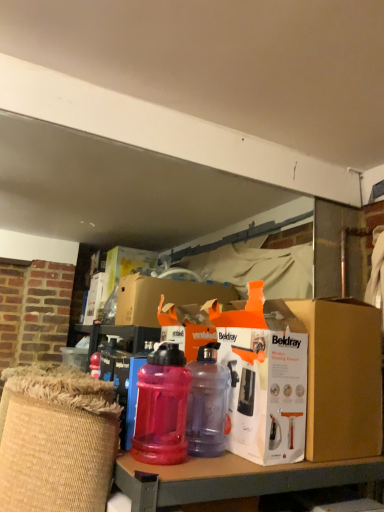
This screenshot has height=512, width=384. What do you see at coordinates (342, 378) in the screenshot?
I see `orange cardboard box at center` at bounding box center [342, 378].

Describe the element at coordinates (207, 404) in the screenshot. The height and width of the screenshot is (512, 384). I see `translucent plastic water bottle at center, which is the second bottle from left to right` at that location.

Identify the location of white cardboard box at center. The height and width of the screenshot is (512, 384). (254, 371).

Find the location of a particular element. The width and height of the screenshot is (384, 512). translucent plastic water bottle at center, the second bottle in the right-to-left sequence is located at coordinates (162, 407).

Between orange cardboard box at center and translucent plastic water bottle at center, the second bottle in the right-to-left sequence, which one has larger size?

Bigger between the two is orange cardboard box at center.

What's the angular difference between orange cardboard box at center and translucent plastic water bottle at center, which is the first bottle from left to right,'s facing directions?

The facing directions of orange cardboard box at center and translucent plastic water bottle at center, which is the first bottle from left to right, are 0.601 degrees apart.

Which is more to the right, orange cardboard box at center or translucent plastic water bottle at center, the second bottle in the right-to-left sequence?

Positioned to the right is orange cardboard box at center.

Considering the positions of points (341, 310) and (150, 373), is point (341, 310) closer to camera compared to point (150, 373)?

No, (341, 310) is further to viewer.

Choose the correct answer: Is translucent plastic water bottle at center, which is the first bottle from left to right, inside orange cardboard box at center or outside it?

translucent plastic water bottle at center, which is the first bottle from left to right, is outside orange cardboard box at center.

Who is bigger, translucent plastic water bottle at center, which is the first bottle from left to right, or orange cardboard box at center?

Bigger between the two is orange cardboard box at center.

Would you consider translucent plastic water bottle at center, which is the first bottle from left to right, to be distant from orange cardboard box at center?

No, translucent plastic water bottle at center, which is the first bottle from left to right, is in close proximity to orange cardboard box at center.

From the image's perspective, is translucent plastic water bottle at center, the second bottle in the right-to-left sequence, beneath orange cardboard box at center?

Yes, from the image's perspective, translucent plastic water bottle at center, the second bottle in the right-to-left sequence, is below orange cardboard box at center.

Between orange cardboard box at center and white cardboard box at center, which one has less height?

With less height is orange cardboard box at center.

Looking at this image, who is bigger, orange cardboard box at center or white cardboard box at center?

With larger size is orange cardboard box at center.

Is orange cardboard box at center with white cardboard box at center?

No, orange cardboard box at center is not with white cardboard box at center.

Is white cardboard box at center not close to translucent plastic water bottle at center, placed as the first bottle when sorted from right to left?

No, there isn't a large distance between white cardboard box at center and translucent plastic water bottle at center, placed as the first bottle when sorted from right to left.

In the scene shown: Would you say white cardboard box at center is to the left or to the right of translucent plastic water bottle at center, which is the second bottle from left to right, in the picture?

white cardboard box at center is to the right of translucent plastic water bottle at center, which is the second bottle from left to right.

From the image's perspective, would you say white cardboard box at center is shown under translucent plastic water bottle at center, placed as the first bottle when sorted from right to left?

Actually, white cardboard box at center appears above translucent plastic water bottle at center, placed as the first bottle when sorted from right to left, in the image.

Consider the image. Is white cardboard box at center in front of or behind translucent plastic water bottle at center, placed as the first bottle when sorted from right to left, in the image?

Visually, white cardboard box at center is located in front of translucent plastic water bottle at center, placed as the first bottle when sorted from right to left.

Is orange cardboard box at center next to translucent plastic water bottle at center, which is the second bottle from left to right?

orange cardboard box at center and translucent plastic water bottle at center, which is the second bottle from left to right, are not in contact.

Which object is positioned more to the left, orange cardboard box at center or translucent plastic water bottle at center, which is the second bottle from left to right?

translucent plastic water bottle at center, which is the second bottle from left to right, is more to the left.

Which of these two, orange cardboard box at center or translucent plastic water bottle at center, placed as the first bottle when sorted from right to left, is thinner?

With smaller width is translucent plastic water bottle at center, placed as the first bottle when sorted from right to left.

From a real-world perspective, does translucent plastic water bottle at center, placed as the first bottle when sorted from right to left, stand above white cardboard box at center?

No.

Can you tell me how much translucent plastic water bottle at center, placed as the first bottle when sorted from right to left, and white cardboard box at center differ in facing direction?

They differ by 0.264 degrees in their facing directions.

Does translucent plastic water bottle at center, which is the second bottle from left to right, turn towards white cardboard box at center?

Yes, translucent plastic water bottle at center, which is the second bottle from left to right, is aimed at white cardboard box at center.

Which object is further away from the camera taking this photo, translucent plastic water bottle at center, which is the second bottle from left to right, or white cardboard box at center?

Positioned behind is translucent plastic water bottle at center, which is the second bottle from left to right.

Does translucent plastic water bottle at center, the second bottle in the right-to-left sequence, have a smaller size compared to white cardboard box at center?

Indeed, translucent plastic water bottle at center, the second bottle in the right-to-left sequence, has a smaller size compared to white cardboard box at center.

Is translucent plastic water bottle at center, the second bottle in the right-to-left sequence, placed right next to white cardboard box at center?

They are not placed beside each other.

Where is `the 2nd bottle counting from the left of the orange cardboard box at center`? the 2nd bottle counting from the left of the orange cardboard box at center is located at coordinates (162, 407).

Locate an element on the screen. Image resolution: width=384 pixels, height=512 pixels. cardboard box above the translucent plastic water bottle at center, the second bottle in the right-to-left sequence (from a real-world perspective) is located at coordinates (342, 378).

Estimate the real-world distances between objects in this image. Which object is further from translucent plastic water bottle at center, placed as the first bottle when sorted from right to left, white cardboard box at center or orange cardboard box at center?

The object further to translucent plastic water bottle at center, placed as the first bottle when sorted from right to left, is orange cardboard box at center.

Based on their spatial positions, is translucent plastic water bottle at center, which is the first bottle from left to right, or white cardboard box at center further from orange cardboard box at center?

translucent plastic water bottle at center, which is the first bottle from left to right, is positioned further to the anchor orange cardboard box at center.

From the image, which object appears to be nearer to translucent plastic water bottle at center, which is the first bottle from left to right, translucent plastic water bottle at center, placed as the first bottle when sorted from right to left, or white cardboard box at center?

translucent plastic water bottle at center, placed as the first bottle when sorted from right to left, is closer to translucent plastic water bottle at center, which is the first bottle from left to right.

Based on their spatial positions, is orange cardboard box at center or white cardboard box at center further from translucent plastic water bottle at center, placed as the first bottle when sorted from right to left?

orange cardboard box at center.

Estimate the real-world distances between objects in this image. Which object is further from translucent plastic water bottle at center, the second bottle in the right-to-left sequence, white cardboard box at center or orange cardboard box at center?

orange cardboard box at center lies further to translucent plastic water bottle at center, the second bottle in the right-to-left sequence, than the other object.

Based on their spatial positions, is orange cardboard box at center or translucent plastic water bottle at center, which is the first bottle from left to right, closer to translucent plastic water bottle at center, which is the second bottle from left to right?

translucent plastic water bottle at center, which is the first bottle from left to right.

When comparing their distances from translucent plastic water bottle at center, the second bottle in the right-to-left sequence, does orange cardboard box at center or white cardboard box at center seem closer?

white cardboard box at center lies closer to translucent plastic water bottle at center, the second bottle in the right-to-left sequence, than the other object.

Based on their spatial positions, is translucent plastic water bottle at center, which is the second bottle from left to right, or translucent plastic water bottle at center, which is the first bottle from left to right, further from orange cardboard box at center?

translucent plastic water bottle at center, which is the first bottle from left to right, is positioned further to the anchor orange cardboard box at center.

This screenshot has height=512, width=384. Identify the location of bottle between translucent plastic water bottle at center, the second bottle in the right-to-left sequence, and white cardboard box at center from left to right. (207, 404).

The height and width of the screenshot is (512, 384). I want to click on bottle situated between translucent plastic water bottle at center, the second bottle in the right-to-left sequence, and orange cardboard box at center from left to right, so click(x=207, y=404).

At what (x,y) coordinates should I click in order to perform the action: click on box located between translucent plastic water bottle at center, the second bottle in the right-to-left sequence, and orange cardboard box at center in the left-right direction. Please return your answer as a coordinate pair (x, y). The width and height of the screenshot is (384, 512). Looking at the image, I should click on (254, 371).

This screenshot has width=384, height=512. In order to click on box between translucent plastic water bottle at center, placed as the first bottle when sorted from right to left, and orange cardboard box at center in this screenshot , I will do `click(254, 371)`.